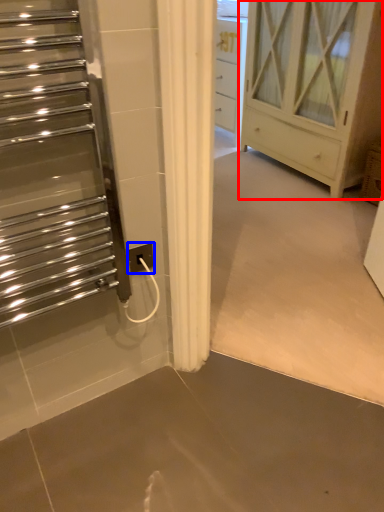
Question: Which object appears closest to the camera in this image, chest of drawers (highlighted by a red box) or electric outlet (highlighted by a blue box)?

Choices:
 (A) chest of drawers
 (B) electric outlet

Answer: (B)